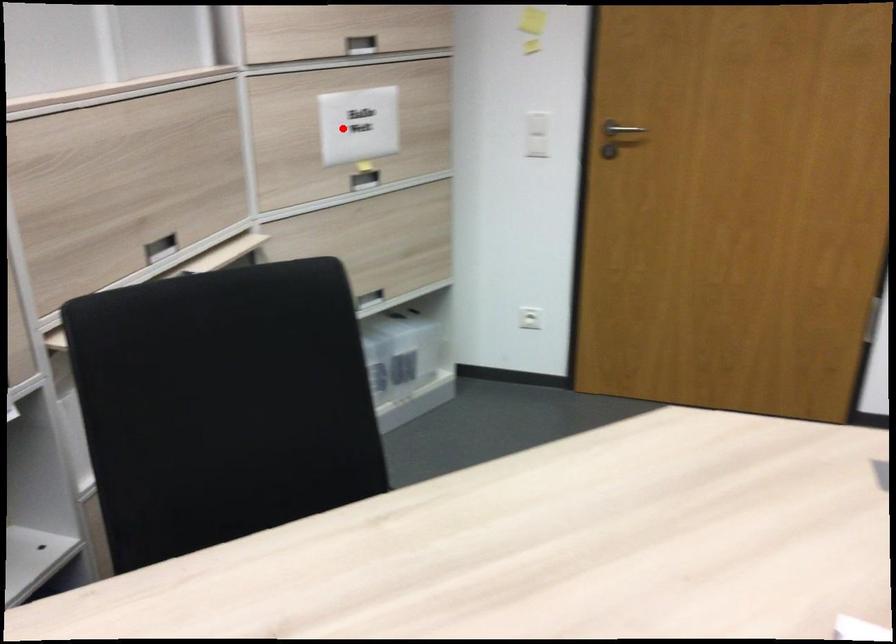
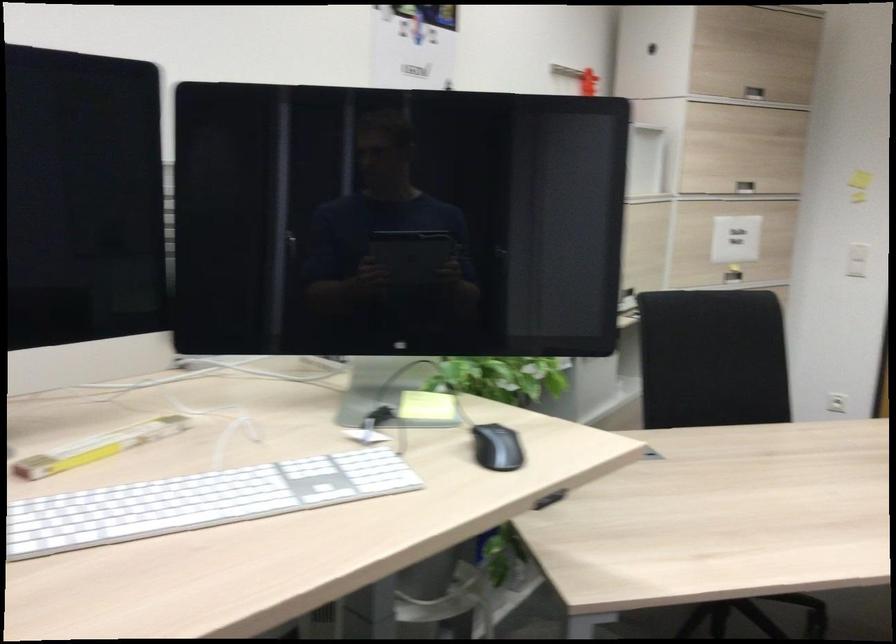
Locate, in the second image, the point that corresponds to the highlighted location in the first image.

(736, 239)